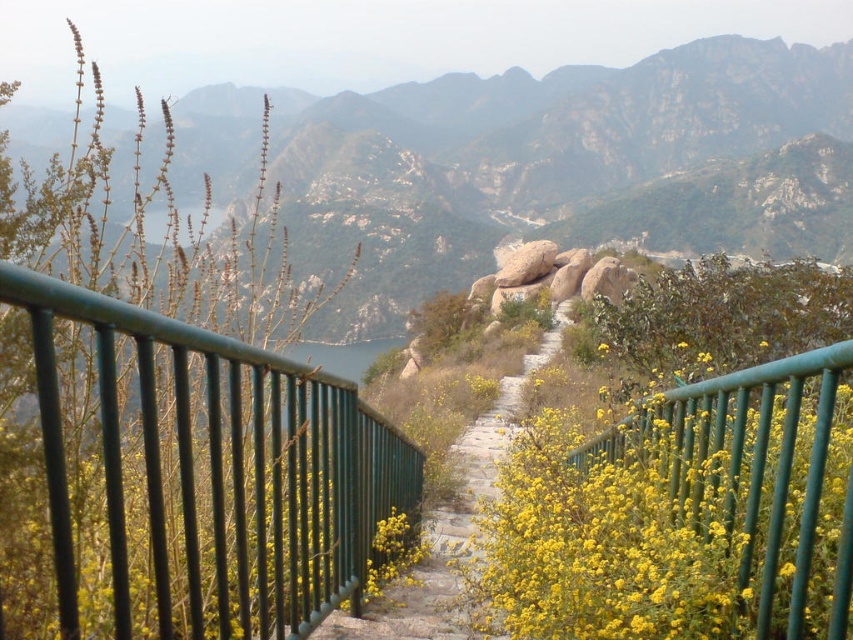
Question: Can you confirm if yellow matte flowers at center is smaller than stone paved path at center?

Choices:
 (A) no
 (B) yes

Answer: (B)

Question: Which is farther from the rocky mountain at upper center?

Choices:
 (A) green metal railing at center
 (B) stone paved path at center
 (C) yellow matte flowers at center

Answer: (C)

Question: Which of the following is the farthest from the observer?

Choices:
 (A) green metal railing at center
 (B) yellow matte flowers at center

Answer: (B)

Question: Does rocky mountain at upper center have a greater width compared to stone paved path at center?

Choices:
 (A) yes
 (B) no

Answer: (A)

Question: Estimate the real-world distances between objects in this image. Which object is farther from the green metal railing at center?

Choices:
 (A) yellow matte flowers at center
 (B) rocky mountain at upper center
 (C) stone paved path at center

Answer: (B)

Question: In this image, where is yellow matte flowers at center located relative to stone paved path at center?

Choices:
 (A) below
 (B) above

Answer: (B)